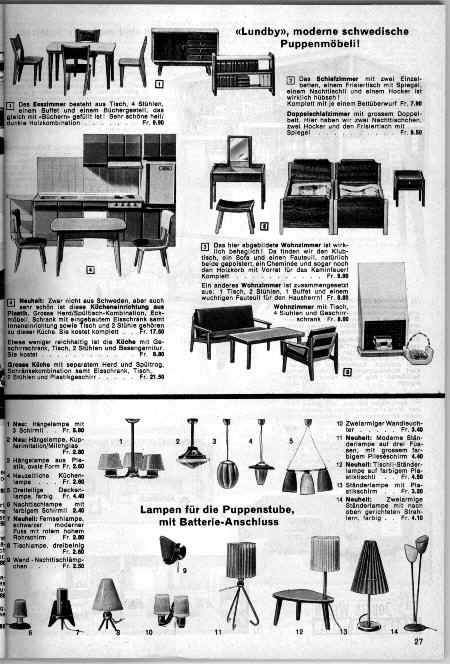
Locate an element on the screen. lamp shades is located at coordinates point(368,572), point(330,548), point(249,554), point(178,603), point(161,599), point(108,593), point(22,607), point(111,465), point(126,456), point(152,461).